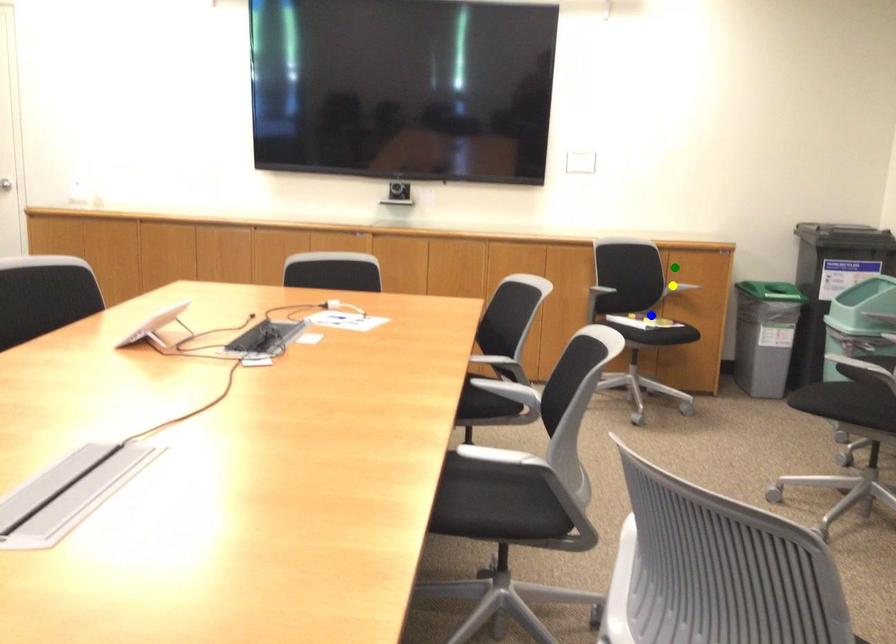
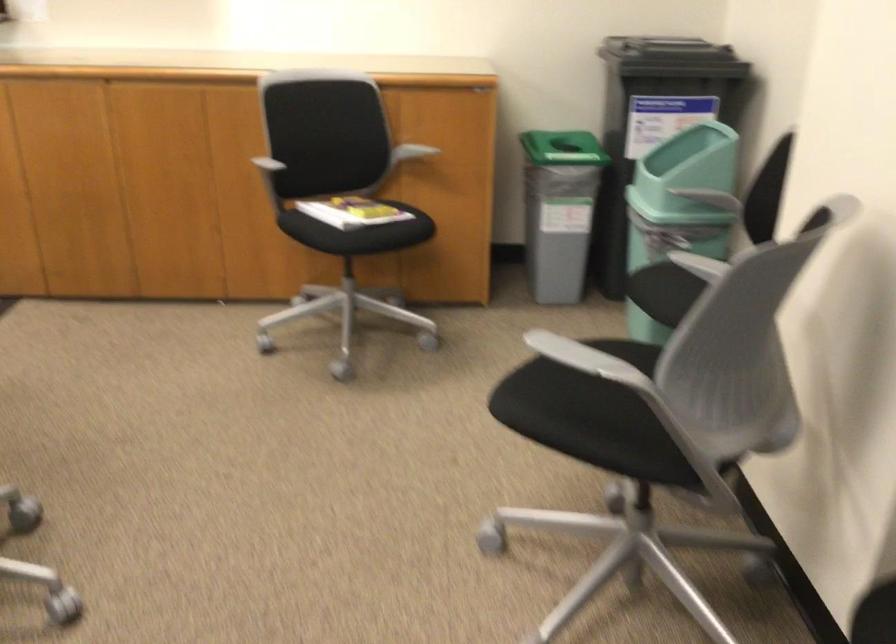
I am providing you with two images of the same scene from different viewpoints. Three points are marked in image1. Which point corresponds to a part or object that is occluded in image2?In image1, three points are marked. Which of them correspond to a part or object that is occluded in image2?Among the three points shown in image1, which one corresponds to a part or object that is no longer visible due to occlusion in image2?

Invisible in image2: yellow point.